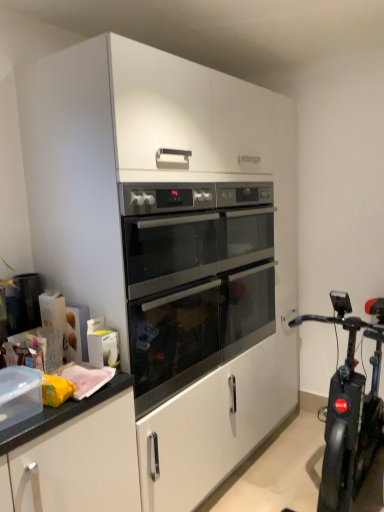
Question: Is black glossy stationary bicycle at right positioned beyond the bounds of stainless steel oven at center?

Choices:
 (A) no
 (B) yes

Answer: (B)

Question: Are black glossy stationary bicycle at right and stainless steel oven at center far apart?

Choices:
 (A) yes
 (B) no

Answer: (B)

Question: Is black glossy stationary bicycle at right taller than stainless steel oven at center?

Choices:
 (A) no
 (B) yes

Answer: (B)

Question: Does black glossy stationary bicycle at right have a greater width compared to stainless steel oven at center?

Choices:
 (A) no
 (B) yes

Answer: (B)

Question: Can you confirm if black glossy stationary bicycle at right is bigger than stainless steel oven at center?

Choices:
 (A) no
 (B) yes

Answer: (B)

Question: From the image's perspective, does black glossy stationary bicycle at right appear lower than stainless steel oven at center?

Choices:
 (A) yes
 (B) no

Answer: (A)

Question: Would you say stainless steel oven at center contains black glossy stationary bicycle at right?

Choices:
 (A) yes
 (B) no

Answer: (B)

Question: Is stainless steel oven at center shorter than black glossy stationary bicycle at right?

Choices:
 (A) yes
 (B) no

Answer: (A)

Question: Is the depth of stainless steel oven at center greater than that of black glossy stationary bicycle at right?

Choices:
 (A) yes
 (B) no

Answer: (A)

Question: Is stainless steel oven at center closer to the viewer compared to black glossy stationary bicycle at right?

Choices:
 (A) no
 (B) yes

Answer: (A)

Question: Is stainless steel oven at center not within black glossy stationary bicycle at right?

Choices:
 (A) no
 (B) yes

Answer: (B)

Question: Considering the relative positions of stainless steel oven at center and black glossy stationary bicycle at right in the image provided, is stainless steel oven at center to the right of black glossy stationary bicycle at right from the viewer's perspective?

Choices:
 (A) yes
 (B) no

Answer: (B)

Question: In the image, is stainless steel oven at center positioned in front of or behind black glossy stationary bicycle at right?

Choices:
 (A) front
 (B) behind

Answer: (B)